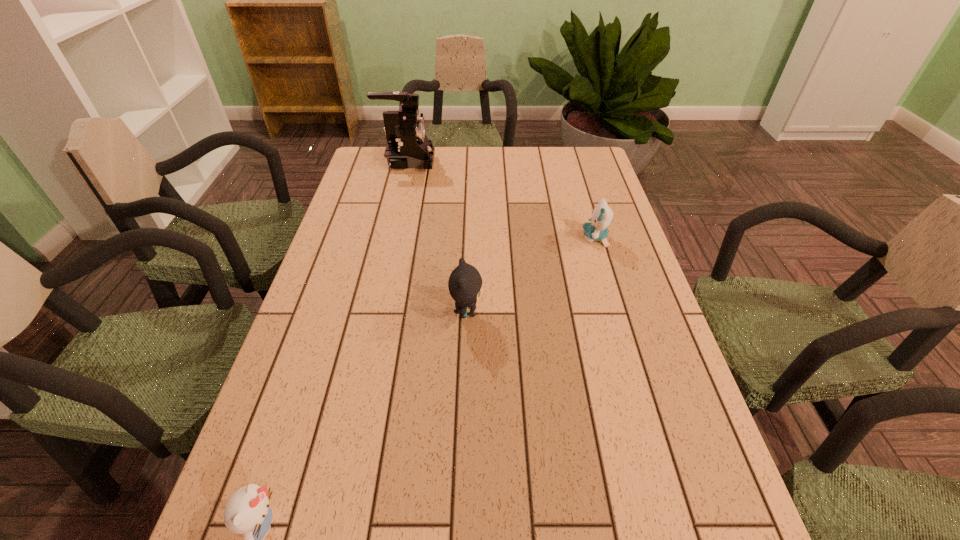
Identify the location of vacant area located 0.380m on the face of the rightmost object. The width and height of the screenshot is (960, 540). point(450,238).

Find the location of a particular element. The width and height of the screenshot is (960, 540). object positioned at the far edge is located at coordinates (407, 146).

Identify the location of object situated at the left edge. (407, 146).

Find the location of a particular element. The height and width of the screenshot is (540, 960). object at the right edge is located at coordinates (596, 230).

Find the location of `object that is positioned at the far left corner`. object that is positioned at the far left corner is located at coordinates (407, 146).

Identify the location of vacant region at the far edge of the desktop. (548, 154).

This screenshot has height=540, width=960. I want to click on free space at the left edge of the desktop, so click(x=340, y=413).

At what (x,y) coordinates should I click in order to perform the action: click on vacant space at the right edge of the desktop. Please return your answer as a coordinate pair (x, y). The width and height of the screenshot is (960, 540). Looking at the image, I should click on (607, 194).

Identify the location of free space at the far left corner. The width and height of the screenshot is (960, 540). (378, 155).

The height and width of the screenshot is (540, 960). I want to click on free area in between the camcorder and the second farthest kitten, so click(x=437, y=237).